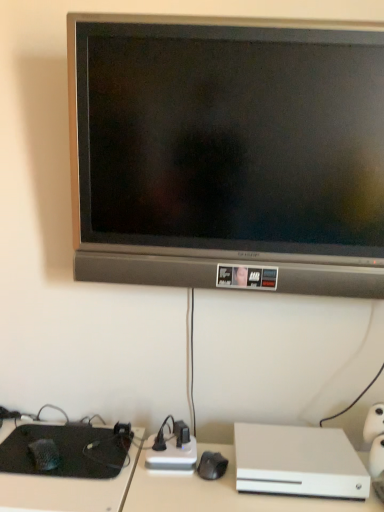
Measure the distance between point (71, 498) and camera.

The depth of point (71, 498) is 37.13 inches.

In order to face matte black tv at upper center, should I rotate leftwards or rightwards?

To align with it, rotate right about 4.899°.

Locate an element on the screen. matte black tv at upper center is located at coordinates (228, 152).

Image resolution: width=384 pixels, height=512 pixels. Find the location of `black matte keyboard at lower left`. black matte keyboard at lower left is located at coordinates (68, 490).

Which point is more forward, [105,494] or [265,458]?

The point [105,494] is closer to the camera.

Does black matte keyboard at lower left have a smaller size compared to white matte xbox one at lower right?

Indeed, black matte keyboard at lower left has a smaller size compared to white matte xbox one at lower right.

Consider the image. Is black matte keyboard at lower left located outside white matte xbox one at lower right?

Absolutely, black matte keyboard at lower left is external to white matte xbox one at lower right.

From a real-world perspective, which object rests below the other?

black matte keyboard at lower left is physically lower.

From a real-world perspective, relative to black matte keyboard at lower left, is white matte xbox one at lower right vertically above or below?

From a real-world perspective, white matte xbox one at lower right is physically above black matte keyboard at lower left.

Is the position of white matte xbox one at lower right less distant than that of black matte keyboard at lower left?

Yes, white matte xbox one at lower right is in front of black matte keyboard at lower left.

I want to click on computer that is above the black matte keyboard at lower left (from a real-world perspective), so click(x=298, y=462).

Considering the positions of objects white matte xbox one at lower right and matte black tv at upper center in the image provided, who is in front, white matte xbox one at lower right or matte black tv at upper center?

matte black tv at upper center is more forward.

Which is farther, (355,494) or (376,146)?

The point (376,146) is farther from the camera.

Does white matte xbox one at lower right appear on the left side of matte black tv at upper center?

In fact, white matte xbox one at lower right is to the right of matte black tv at upper center.

How many degrees apart are the facing directions of white matte xbox one at lower right and matte black tv at upper center?

The facing directions of white matte xbox one at lower right and matte black tv at upper center are 0.000482 degrees apart.

Which object is positioned more to the left, matte black tv at upper center or white matte xbox one at lower right?

From the viewer's perspective, matte black tv at upper center appears more on the left side.

From the image's perspective, between matte black tv at upper center and white matte xbox one at lower right, who is located below?

white matte xbox one at lower right appears lower in the image.

Measure the distance from matte black tv at upper center to white matte xbox one at lower right.

matte black tv at upper center and white matte xbox one at lower right are 60.46 centimeters apart.

Consider the image. In the image, is matte black tv at upper center positioned in front of or behind white matte xbox one at lower right?

matte black tv at upper center is positioned closer to the viewer than white matte xbox one at lower right.

Can you confirm if matte black tv at upper center is positioned to the right of black matte keyboard at lower left?

Correct, you'll find matte black tv at upper center to the right of black matte keyboard at lower left.

Considering the relative sizes of matte black tv at upper center and black matte keyboard at lower left in the image provided, is matte black tv at upper center bigger than black matte keyboard at lower left?

Yes.

Identify the location of television in front of the black matte keyboard at lower left. This screenshot has height=512, width=384. pyautogui.click(x=228, y=152).

Considering the positions of points (284, 49) and (69, 506), is point (284, 49) farther from camera compared to point (69, 506)?

Yes, it is behind point (69, 506).

Is black matte keyboard at lower left far from matte black tv at upper center?

Actually, black matte keyboard at lower left and matte black tv at upper center are a little close together.

Is black matte keyboard at lower left turned away from matte black tv at upper center?

black matte keyboard at lower left does not have its back to matte black tv at upper center.

Considering the positions of points (52, 505) and (369, 170), is point (52, 505) closer to camera compared to point (369, 170)?

Yes, it is.

This screenshot has height=512, width=384. I want to click on computer above the black matte keyboard at lower left (from a real-world perspective), so click(298, 462).

This screenshot has width=384, height=512. I want to click on computer desk behind the white matte xbox one at lower right, so click(68, 490).

Estimate the real-world distances between objects in this image. Which object is further from black matte keyboard at lower left, matte black tv at upper center or white matte xbox one at lower right?

matte black tv at upper center.

When comparing their distances from matte black tv at upper center, does white matte xbox one at lower right or black matte keyboard at lower left seem further?

black matte keyboard at lower left.

From the image, which object appears to be farther from black matte keyboard at lower left, white matte xbox one at lower right or matte black tv at upper center?

Based on the image, matte black tv at upper center appears to be further to black matte keyboard at lower left.

From the picture: Looking at the image, which one is located further to white matte xbox one at lower right, black matte keyboard at lower left or matte black tv at upper center?

Among the two, matte black tv at upper center is located further to white matte xbox one at lower right.

Estimate the real-world distances between objects in this image. Which object is further from white matte xbox one at lower right, matte black tv at upper center or black matte keyboard at lower left?

matte black tv at upper center is further to white matte xbox one at lower right.

From the image, which object appears to be farther from matte black tv at upper center, black matte keyboard at lower left or white matte xbox one at lower right?

Based on the image, black matte keyboard at lower left appears to be further to matte black tv at upper center.

Image resolution: width=384 pixels, height=512 pixels. I want to click on computer between matte black tv at upper center and black matte keyboard at lower left in the vertical direction, so click(x=298, y=462).